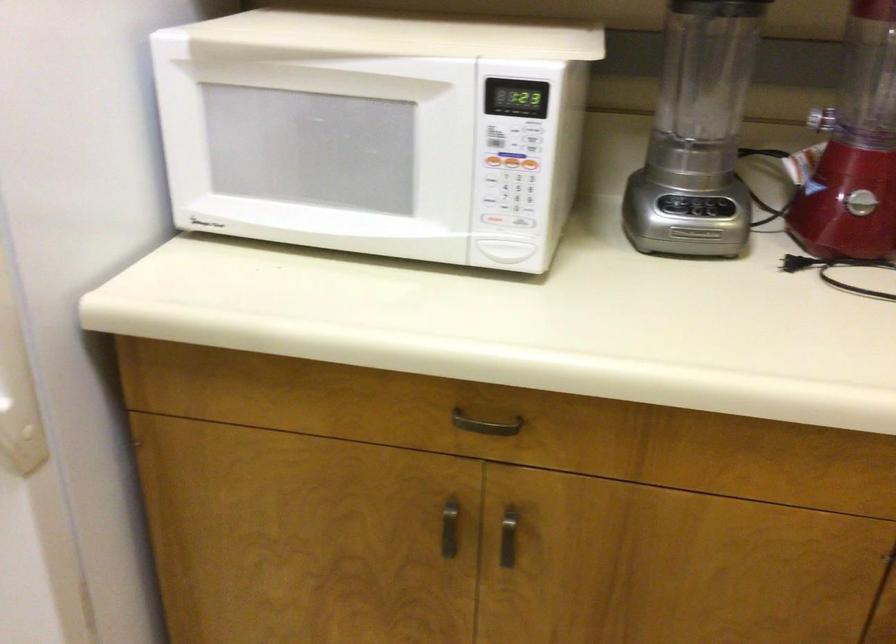
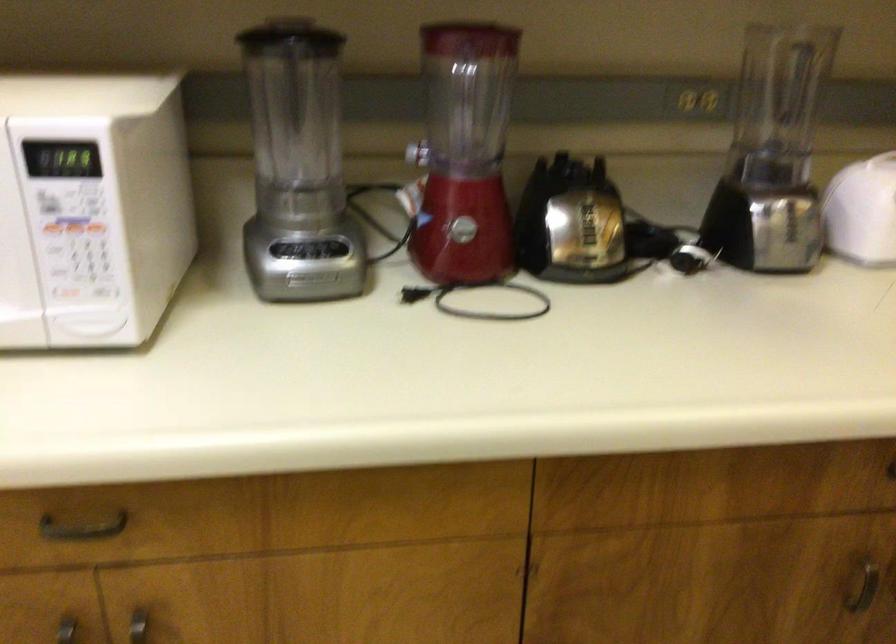
The point at (511,174) is marked in the first image. Where is the corresponding point in the second image?

(74, 242)